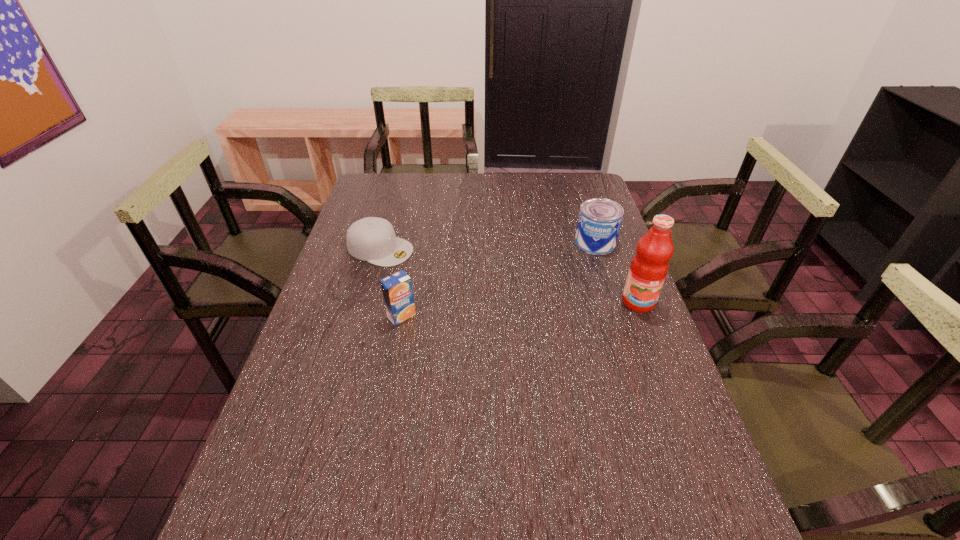
You are a GUI agent. You are given a task and a screenshot of the screen. Output one action in this format:
    pyautogui.click(x=<x>, y=<y>)
    Task: Click on the free space on the desktop that is between the orange_juice and the tallest object and is positioned on the front-facing side of the cap
    
    Given the screenshot: What is the action you would take?
    pyautogui.click(x=554, y=307)

The width and height of the screenshot is (960, 540). In order to click on free spot on the desktop that is between the orange_juice and the tallest object and is positioned on the front label of the can in this screenshot , I will do `click(538, 308)`.